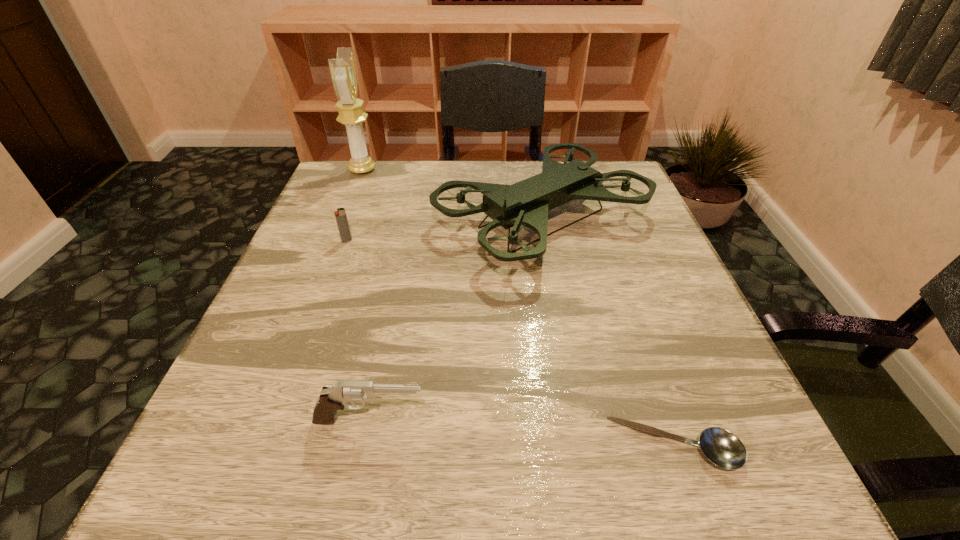
This screenshot has width=960, height=540. I want to click on unoccupied area between the gun and the ladle, so click(522, 434).

This screenshot has width=960, height=540. I want to click on vacant point located between the igniter and the shortest object, so click(511, 343).

The width and height of the screenshot is (960, 540). Find the location of `vacant region between the gun and the second tallest object`. vacant region between the gun and the second tallest object is located at coordinates (456, 320).

The width and height of the screenshot is (960, 540). I want to click on vacant region between the gun and the award, so click(x=366, y=295).

Locate an element on the screen. Image resolution: width=960 pixels, height=540 pixels. empty space that is in between the gun and the ladle is located at coordinates (522, 434).

At what (x,y) coordinates should I click in order to perform the action: click on unoccupied position between the igniter and the gun. Please return your answer as a coordinate pair (x, y). Looking at the image, I should click on (358, 330).

Locate an element on the screen. free space between the shortest object and the gun is located at coordinates (522, 434).

The width and height of the screenshot is (960, 540). I want to click on free space between the drone and the ladle, so pos(609,333).

This screenshot has height=540, width=960. In order to click on object identified as the fourth closest to the third shortest object in this screenshot , I will do `click(342, 69)`.

Identify which object is the nearest to the third shortest object. Please provide its 2D coordinates. Your answer should be formatted as a tuple, i.e. [(x, y)], where the tuple contains the x and y coordinates of a point satisfying the conditions above.

[(724, 449)]